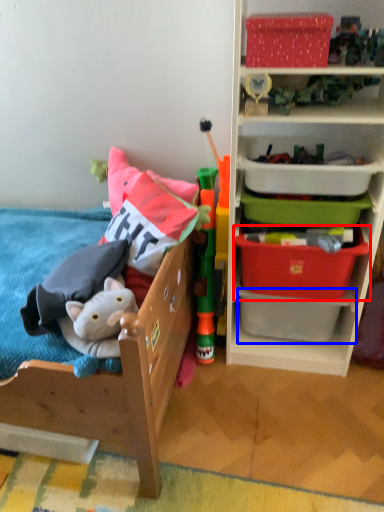
Question: Which object is closer to the camera taking this photo, storage box (highlighted by a red box) or storage box (highlighted by a blue box)?

Choices:
 (A) storage box
 (B) storage box

Answer: (A)